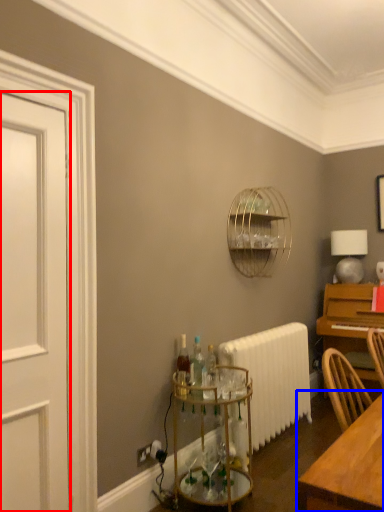
Question: Which object is closer to the camera taking this photo, door (highlighted by a red box) or table (highlighted by a blue box)?

Choices:
 (A) door
 (B) table

Answer: (B)